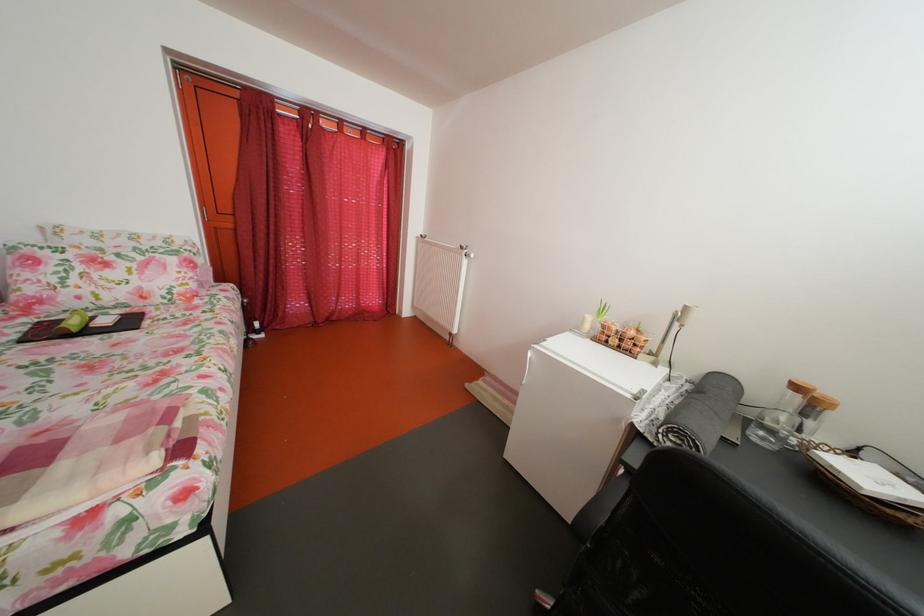
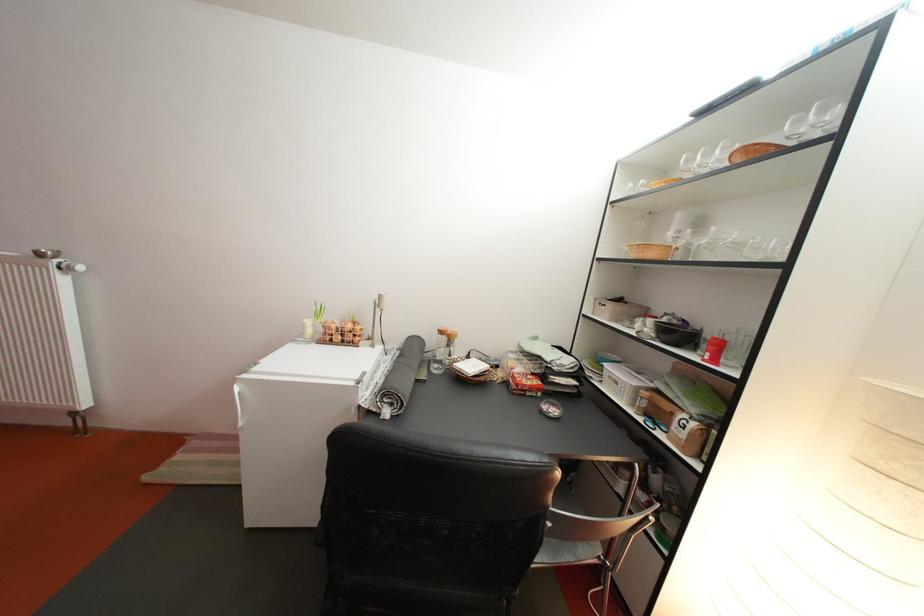
Where in the second image is the point corresponding to (x=775, y=399) from the first image?

(444, 346)